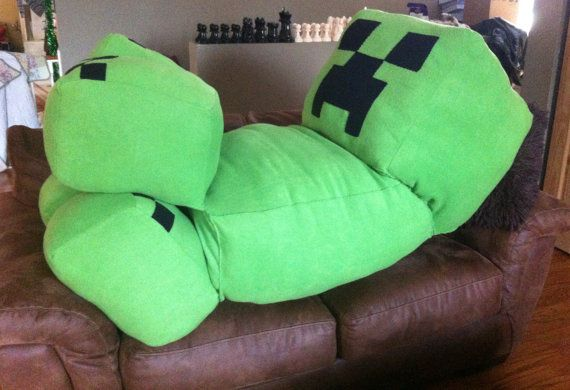
This screenshot has height=390, width=570. Identify the location of couch. (390, 313).